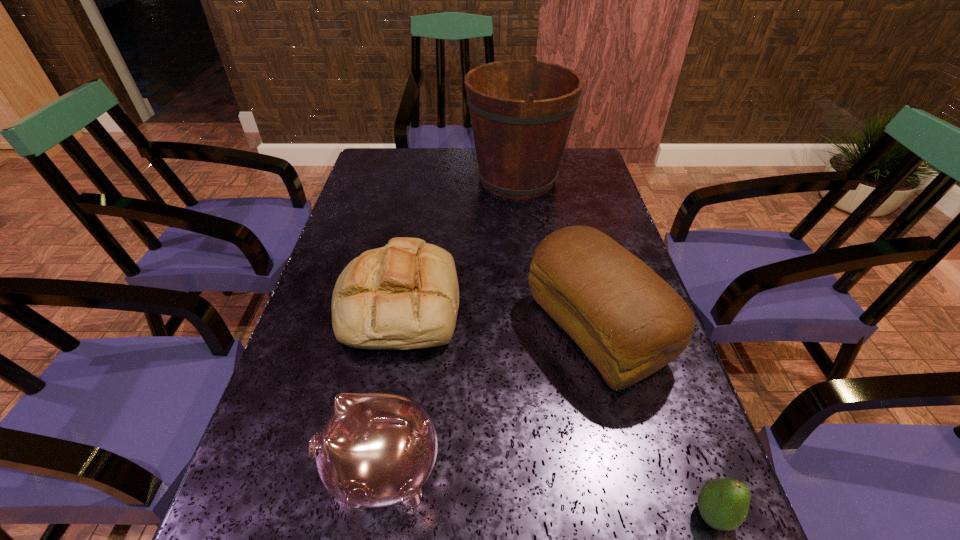
Locate an element on the screen. vacant region located on the front facing side of the third tallest object is located at coordinates (295, 471).

Identify the location of free spot located on the front facing side of the third tallest object. (259, 471).

Locate an element on the screen. The width and height of the screenshot is (960, 540). blank space located on the front facing side of the third tallest object is located at coordinates (265, 471).

At what (x,y) coordinates should I click in order to perform the action: click on free space located 0.270m on the right of the left bread. Please return your answer as a coordinate pair (x, y). Looking at the image, I should click on (577, 304).

Identify the location of vacant space situated on the back of the avocado. The width and height of the screenshot is (960, 540). (684, 435).

In order to click on object present at the far edge in this screenshot , I will do `click(521, 111)`.

Identify the location of piggy bank that is at the left edge. Image resolution: width=960 pixels, height=540 pixels. (377, 449).

Find the location of `bread that is at the left edge`. bread that is at the left edge is located at coordinates (405, 295).

This screenshot has width=960, height=540. What are the coordinates of `bucket that is at the right edge` in the screenshot? It's located at (521, 111).

The height and width of the screenshot is (540, 960). What are the coordinates of `bread located at the right edge` in the screenshot? It's located at (630, 323).